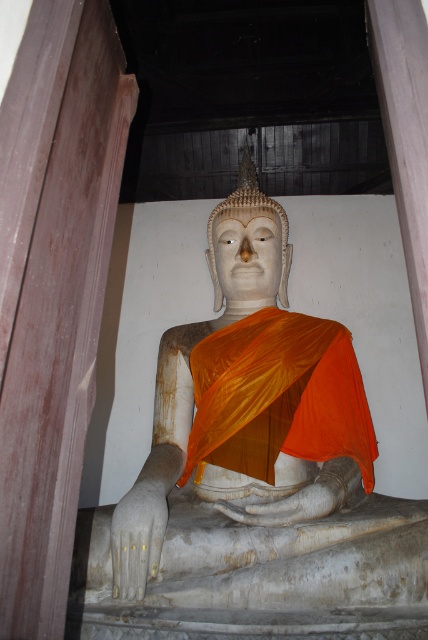
Can you confirm if white marble statue at center is taller than orange silk robe at center?

Correct, white marble statue at center is much taller as orange silk robe at center.

Does white marble statue at center have a lesser width compared to orange silk robe at center?

No.

Locate an element on the screen. white marble statue at center is located at coordinates (255, 456).

The image size is (428, 640). I want to click on white marble statue at center, so click(x=255, y=456).